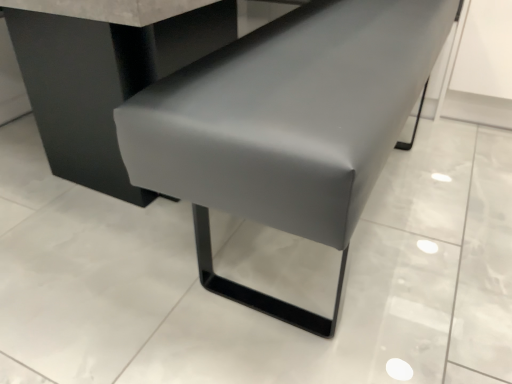
Describe the element at coordinates (242, 306) in the screenshot. I see `matte gray concrete at center` at that location.

Identify the location of matte gray concrete at center. (242, 306).

The image size is (512, 384). Describe the element at coordinates (286, 127) in the screenshot. I see `matte gray bench at center` at that location.

Measure the distance between point [155,116] and camera.

The depth of point [155,116] is 25.12 inches.

Identify the location of matte gray bench at center. (286, 127).

Where is `matte gray concrete at center`? matte gray concrete at center is located at coordinates (242, 306).

From the picture: Considering the relative positions of matte gray concrete at center and matte gray bench at center in the image provided, is matte gray concrete at center to the right of matte gray bench at center from the viewer's perspective?

Incorrect, matte gray concrete at center is not on the right side of matte gray bench at center.

Is matte gray concrete at center further to the viewer compared to matte gray bench at center?

Yes.

Which is behind, point (368, 362) or point (351, 18)?

The point (351, 18) is behind.

From the image's perspective, which is above, matte gray concrete at center or matte gray bench at center?

matte gray concrete at center, from the image's perspective.

From a real-world perspective, which object rests below the other?

matte gray bench at center, from a real-world perspective.

From the picture: Can you confirm if matte gray concrete at center is wider than matte gray bench at center?

Yes, matte gray concrete at center is wider than matte gray bench at center.

Considering the relative sizes of matte gray concrete at center and matte gray bench at center in the image provided, is matte gray concrete at center taller than matte gray bench at center?

Indeed, matte gray concrete at center has a greater height compared to matte gray bench at center.

Between matte gray concrete at center and matte gray bench at center, which one has smaller size?

matte gray bench at center.

Which is correct: matte gray concrete at center is inside matte gray bench at center, or outside of it?

The correct answer is: outside.

Is there a large distance between matte gray concrete at center and matte gray bench at center?

They are positioned close to each other.

Is matte gray concrete at center turned away from matte gray bench at center?

No.

Find the location of a particular element. This screenshot has height=384, width=512. furniture in front of the matte gray concrete at center is located at coordinates (286, 127).

Between matte gray bench at center and matte gray concrete at center, which one appears on the right side from the viewer's perspective?

matte gray bench at center.

Looking at this image, in the image, is matte gray bench at center positioned in front of or behind matte gray concrete at center?

Clearly, matte gray bench at center is in front of matte gray concrete at center.

Is point (127, 129) positioned behind point (209, 307)?

That is False.

From the image's perspective, which one is positioned lower, matte gray bench at center or matte gray concrete at center?

matte gray bench at center is shown below in the image.

From a real-world perspective, is matte gray bench at center positioned under matte gray concrete at center based on gravity?

Correct, in the physical world, matte gray bench at center is lower than matte gray concrete at center.

Considering the relative sizes of matte gray bench at center and matte gray concrete at center in the image provided, is matte gray bench at center thinner than matte gray concrete at center?

Correct, the width of matte gray bench at center is less than that of matte gray concrete at center.

Considering the sizes of objects matte gray bench at center and matte gray concrete at center in the image provided, who is taller, matte gray bench at center or matte gray concrete at center?

matte gray concrete at center.

Between matte gray bench at center and matte gray concrete at center, which one has smaller size?

Smaller between the two is matte gray bench at center.

Is matte gray bench at center inside the boundaries of matte gray concrete at center, or outside?

matte gray bench at center can be found inside matte gray concrete at center.

Is matte gray bench at center placed right next to matte gray concrete at center?

No.

Is matte gray bench at center positioned with its back to matte gray concrete at center?

Correct, matte gray bench at center is looking away from matte gray concrete at center.

What's the angular difference between matte gray bench at center and matte gray concrete at center's facing directions?

matte gray bench at center and matte gray concrete at center are facing 180 degrees away from each other.

This screenshot has height=384, width=512. Find the location of `furniture below the matte gray concrete at center (from a real-world perspective)`. furniture below the matte gray concrete at center (from a real-world perspective) is located at coordinates (286, 127).

Image resolution: width=512 pixels, height=384 pixels. Identify the location of concrete behind the matte gray bench at center. (242, 306).

Find the location of a particular element. The height and width of the screenshot is (384, 512). furniture below the matte gray concrete at center (from a real-world perspective) is located at coordinates (286, 127).